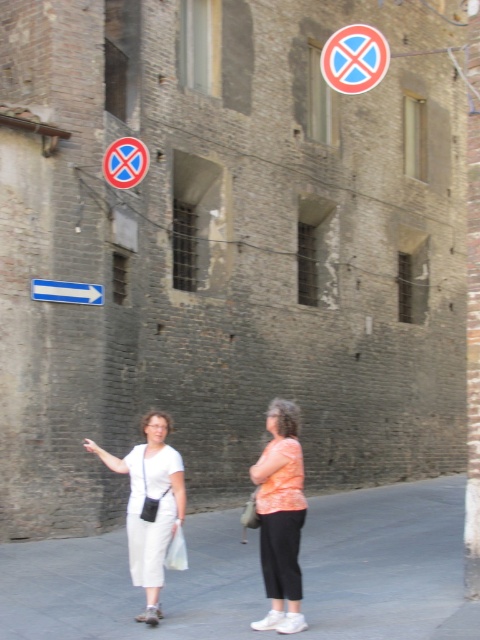
Question: Does white cotton pants at lower left have a greater width compared to blue circular sign at upper left?

Choices:
 (A) no
 (B) yes

Answer: (B)

Question: Considering the relative positions of white cotton pants at lower left and blue circular sign at upper left in the image provided, where is white cotton pants at lower left located with respect to blue circular sign at upper left?

Choices:
 (A) below
 (B) above

Answer: (A)

Question: Does blue circular sign with red x at upper center appear over blue circular sign at upper left?

Choices:
 (A) yes
 (B) no

Answer: (A)

Question: Which of the following is the farthest from the observer?

Choices:
 (A) blue plastic arrow at left
 (B) orange cotton shirt at center

Answer: (A)

Question: Which point is farther from the camera taking this photo?

Choices:
 (A) (160, 442)
 (B) (278, 531)
 (C) (101, 288)
 (D) (347, 88)

Answer: (C)

Question: Which point is closer to the camera taking this photo?

Choices:
 (A) (276, 621)
 (B) (107, 154)
 (C) (146, 632)

Answer: (A)